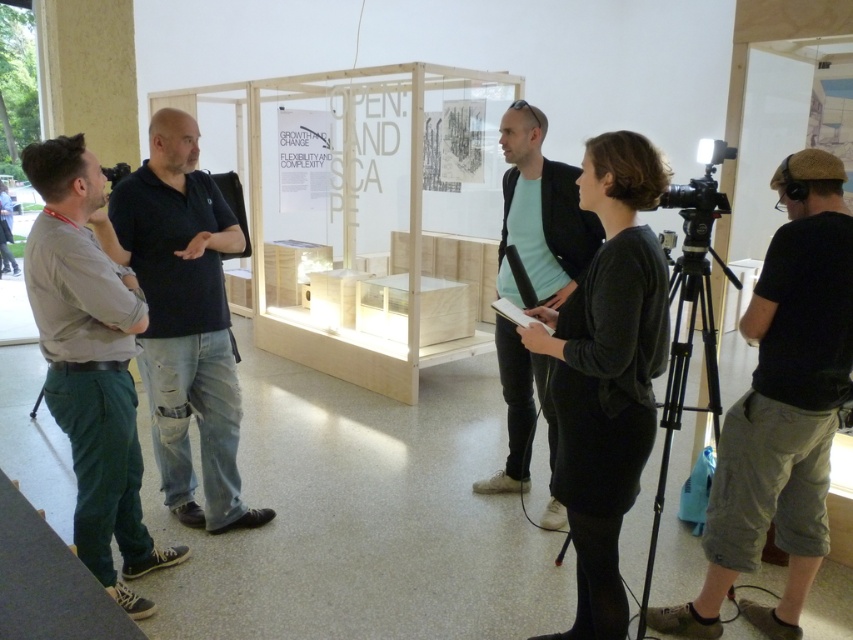
Between point (548, 248) and point (682, 260), which one is positioned behind?

Point (548, 248)

Where is `light blue t-shirt at center`? light blue t-shirt at center is located at coordinates 541,212.

This screenshot has width=853, height=640. I want to click on light blue t-shirt at center, so pos(541,212).

Which is behind, point (161, 333) or point (561, 186)?

The point (561, 186) is more distant.

Does point (196, 337) come in front of point (521, 180)?

Yes, point (196, 337) is closer to viewer.

Is point (140, 182) more distant than point (595, 241)?

No, it is not.

You are a GUI agent. You are given a task and a screenshot of the screen. Output one action in this format:
    pyautogui.click(x=<x>, y=<y>)
    Task: Click on the dark blue shirt at center
    
    Given the screenshot: What is the action you would take?
    pyautogui.click(x=183, y=317)

Between green cotton pants at left and light blue t-shirt at center, which one is positioned higher?

light blue t-shirt at center is higher up.

Does point (68, 186) come in front of point (543, 230)?

That is True.

Which is behind, point (109, 445) or point (527, 429)?

Positioned behind is point (527, 429).

Find the location of a particular element. This screenshot has width=853, height=640. green cotton pants at left is located at coordinates (90, 364).